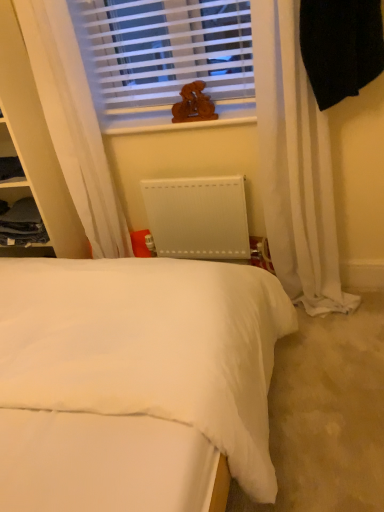
Question: From a real-world perspective, is white sheer curtain at upper left physically located above or below white plastic blinds at upper center?

Choices:
 (A) above
 (B) below

Answer: (B)

Question: From the image's perspective, is white sheer curtain at upper left positioned above or below white plastic blinds at upper center?

Choices:
 (A) above
 (B) below

Answer: (B)

Question: Which object is the closest to the dark gray fabric cabinet at left?

Choices:
 (A) white sheer curtain at upper left
 (B) white matte radiator at center
 (C) white plastic blinds at upper center
 (D) white soft bed at center
 (E) wooden carving at upper center

Answer: (A)

Question: Based on their relative distances, which object is nearer to the dark gray fabric cabinet at left?

Choices:
 (A) white matte radiator at center
 (B) white sheer curtain at upper left
 (C) white soft bed at center
 (D) white plastic blinds at upper center
 (E) wooden carving at upper center

Answer: (B)